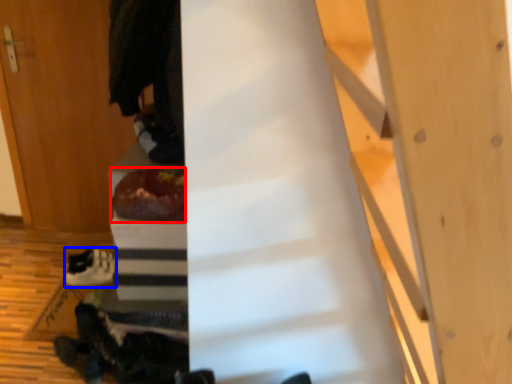
Question: Which of the following is the farthest to the observer, food (highlighted by a red box) or footwear (highlighted by a blue box)?

Choices:
 (A) food
 (B) footwear

Answer: (B)